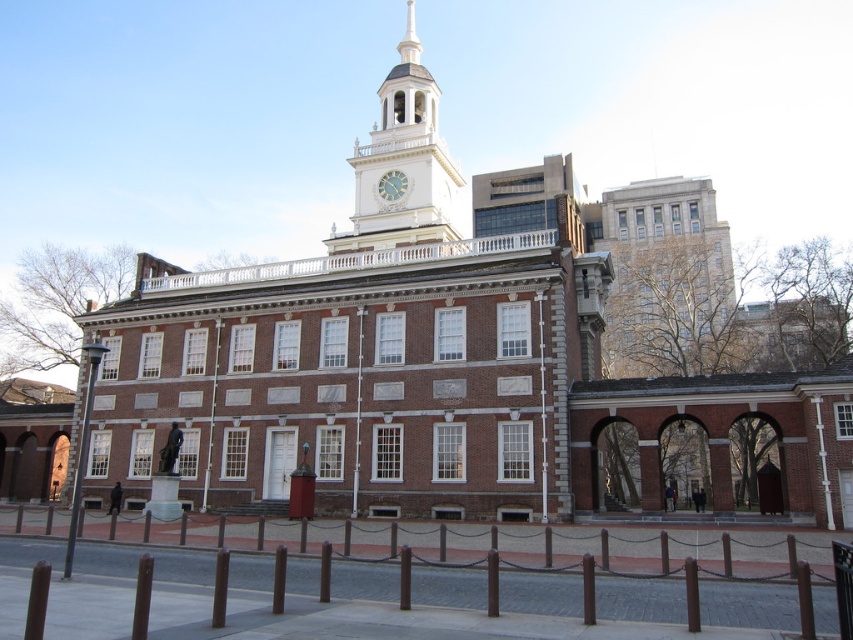
Question: Which of the following is the closest to the observer?

Choices:
 (A) (389, 214)
 (B) (405, 188)

Answer: (A)

Question: Where is white painted wood clock tower at upper center located in relation to matte white clock at center in the image?

Choices:
 (A) above
 (B) below

Answer: (A)

Question: Can you confirm if white painted wood clock tower at upper center is positioned to the left of matte white clock at center?

Choices:
 (A) yes
 (B) no

Answer: (B)

Question: Which point is closer to the camera?

Choices:
 (A) white painted wood clock tower at upper center
 (B) matte white clock at center

Answer: (A)

Question: Which object is closer to the camera taking this photo?

Choices:
 (A) white painted wood clock tower at upper center
 (B) matte white clock at center

Answer: (A)

Question: Can you confirm if white painted wood clock tower at upper center is smaller than matte white clock at center?

Choices:
 (A) yes
 (B) no

Answer: (B)